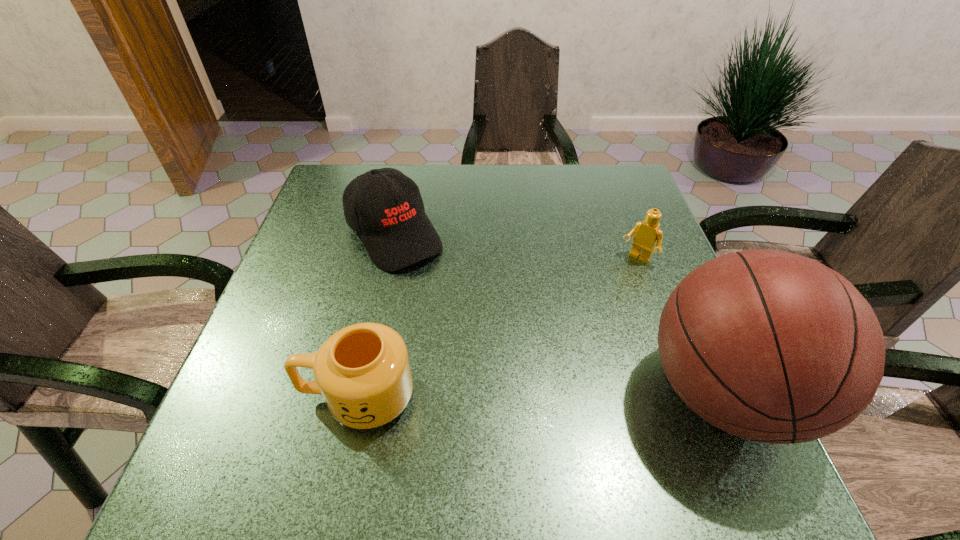
What are the coordinates of `object that is at the far left corner` in the screenshot? It's located at (384, 206).

This screenshot has height=540, width=960. Find the location of `object situated at the near left corner`. object situated at the near left corner is located at coordinates (363, 371).

Where is `object that is at the near right corner`? The height and width of the screenshot is (540, 960). object that is at the near right corner is located at coordinates (770, 346).

Locate an element on the screen. free space at the far edge is located at coordinates (449, 201).

Where is `vacant space at the left edge of the desktop`? This screenshot has height=540, width=960. vacant space at the left edge of the desktop is located at coordinates (343, 227).

This screenshot has width=960, height=540. In the image, there is a desktop. In order to click on vacant space at the far left corner in this screenshot , I will do `click(371, 164)`.

Locate an element on the screen. This screenshot has width=960, height=540. vacant area at the far right corner is located at coordinates (599, 177).

At what (x,y) coordinates should I click in order to perform the action: click on unoccupied position between the Lego and the mug. Please return your answer as a coordinate pair (x, y). Image resolution: width=960 pixels, height=540 pixels. Looking at the image, I should click on pyautogui.click(x=497, y=328).

This screenshot has height=540, width=960. I want to click on vacant area that lies between the baseball cap and the mug, so click(x=376, y=315).

Image resolution: width=960 pixels, height=540 pixels. I want to click on vacant point located between the basketball and the baseball cap, so click(x=559, y=314).